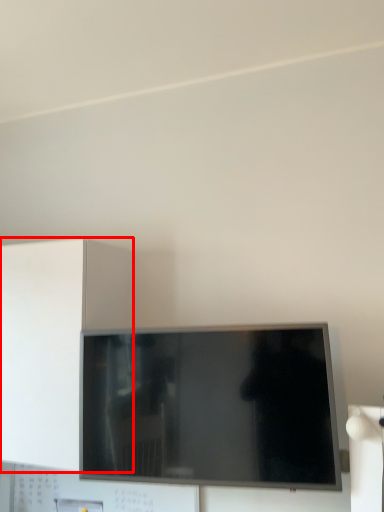
Question: From the image's perspective, where is cabinetry (annotated by the red box) located relative to television?

Choices:
 (A) above
 (B) below

Answer: (A)